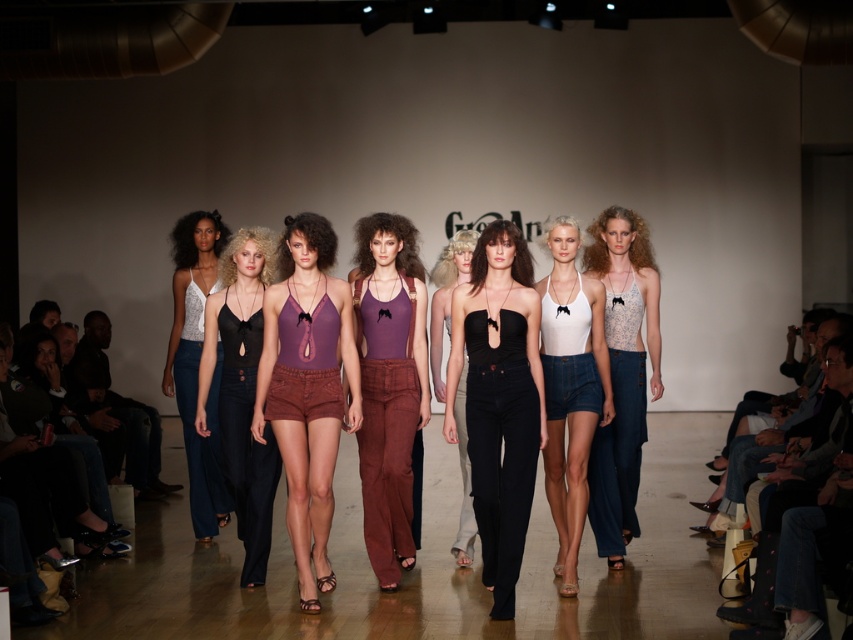
Does black matte top at center have a lesser height compared to matte purple tank top at center?

Correct, black matte top at center is not as tall as matte purple tank top at center.

Is black matte top at center above matte purple tank top at center?

Incorrect, black matte top at center is not positioned above matte purple tank top at center.

This screenshot has height=640, width=853. I want to click on black matte top at center, so click(498, 400).

Does white matte halter top at center have a lesser height compared to matte white tank top at left?

Yes, white matte halter top at center is shorter than matte white tank top at left.

Is white matte halter top at center closer to the viewer compared to matte white tank top at left?

Yes, it is in front of matte white tank top at left.

Find the location of a particular element. The width and height of the screenshot is (853, 640). white matte halter top at center is located at coordinates (570, 388).

Locate an element on the screen. white matte halter top at center is located at coordinates (570, 388).

Can you confirm if light blue denim skirt at right is smaller than matte white tank top at left?

Indeed, light blue denim skirt at right has a smaller size compared to matte white tank top at left.

From the picture: Is light blue denim skirt at right closer to the viewer compared to matte white tank top at left?

That is True.

Where is `light blue denim skirt at right`? The image size is (853, 640). light blue denim skirt at right is located at coordinates coord(622,372).

Locate an element on the screen. Image resolution: width=853 pixels, height=640 pixels. light blue denim skirt at right is located at coordinates (622, 372).